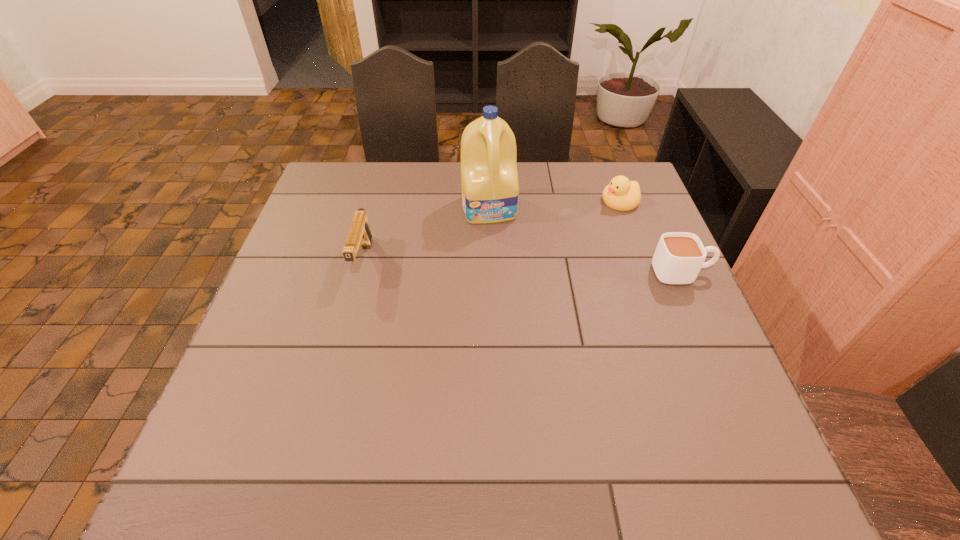
This screenshot has width=960, height=540. What are the coordinates of `vacant space on the desktop that is between the second tallest object and the cup and is positioned on the face of the duckling` in the screenshot? It's located at (481, 265).

You are a GUI agent. You are given a task and a screenshot of the screen. Output one action in this format:
    pyautogui.click(x=<x>, y=<y>)
    Task: Click on the vacant space on the desktop that is between the second tallest object and the cup and is positioned on the label of the third object from right to left
    
    Given the screenshot: What is the action you would take?
    pyautogui.click(x=505, y=266)